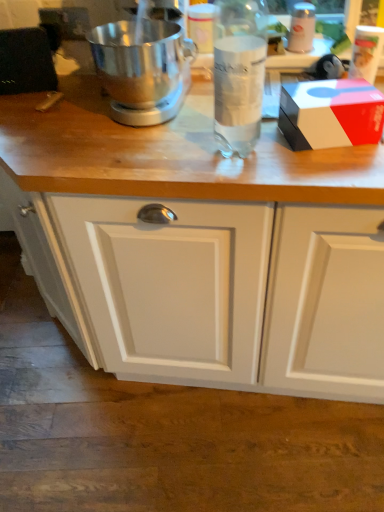
In order to face clear glass bottle at center, the second bottle in the right-to-left sequence, should I rotate leftwards or rightwards?

Turn right approximately 6.570 degrees to face it.

What do you see at coordinates (213, 289) in the screenshot? This screenshot has width=384, height=512. I see `white matte cabinet at lower center` at bounding box center [213, 289].

Find the location of `white glossy bottle at upper right, which is counted as the 1th bottle, starting from the back`. white glossy bottle at upper right, which is counted as the 1th bottle, starting from the back is located at coordinates (302, 28).

Locate an element on the screen. The image size is (384, 512). polished silver mixer at center is located at coordinates (143, 69).

Identify the location of clear glass bottle at center, which appears as the 1th bottle when viewed from the front. (239, 73).

Is white matte cabinet at lower center facing towards polished silver mixer at center?

No, white matte cabinet at lower center is not facing towards polished silver mixer at center.

From the image's perspective, between white matte cabinet at lower center and polished silver mixer at center, who is located below?

white matte cabinet at lower center.

Based on the photo, which object is wider, white matte cabinet at lower center or polished silver mixer at center?

white matte cabinet at lower center is wider.

The image size is (384, 512). Identify the location of cabinetry below the polished silver mixer at center (from the image's perspective). (213, 289).

Which object is wider, clear glass bottle at center, which is the 1th bottle in bottom-to-top order, or polished silver mixer at center?

Wider between the two is polished silver mixer at center.

Visually, is clear glass bottle at center, positioned as the second bottle in back-to-front order, positioned to the left or to the right of polished silver mixer at center?

From the image, it's evident that clear glass bottle at center, positioned as the second bottle in back-to-front order, is to the right of polished silver mixer at center.

From a real-world perspective, who is located lower, clear glass bottle at center, the second bottle positioned from the top, or polished silver mixer at center?

polished silver mixer at center.

How much distance is there between clear glass bottle at center, which appears as the 1th bottle when viewed from the front, and polished silver mixer at center?

The distance of clear glass bottle at center, which appears as the 1th bottle when viewed from the front, from polished silver mixer at center is 10.22 inches.

From the image's perspective, is white matte cabinet at lower center over clear glass bottle at center, which appears as the 1th bottle when viewed from the front?

No, from the image's perspective, white matte cabinet at lower center is not over clear glass bottle at center, which appears as the 1th bottle when viewed from the front.

Which point is more forward, (170,203) or (248,48)?

Point (248,48)

Is clear glass bottle at center, positioned as the second bottle in back-to-front order, a part of white matte cabinet at lower center?

Definitely not — clear glass bottle at center, positioned as the second bottle in back-to-front order, is not inside white matte cabinet at lower center.

From the image's perspective, between polished silver mixer at center and white glossy bottle at upper right, which ranks as the second bottle in left-to-right order, which one is located above?

white glossy bottle at upper right, which ranks as the second bottle in left-to-right order.

Who is taller, polished silver mixer at center or white glossy bottle at upper right, which is counted as the 1th bottle, starting from the back?

With more height is polished silver mixer at center.

Based on their positions, is polished silver mixer at center located to the left or right of white glossy bottle at upper right, the 1th bottle in the top-to-bottom sequence?

polished silver mixer at center is positioned on white glossy bottle at upper right, the 1th bottle in the top-to-bottom sequence,'s left side.

Can you tell me how much polished silver mixer at center and white glossy bottle at upper right, marked as the first bottle in a right-to-left arrangement, differ in facing direction?

There is a 1.33-degree angle between the facing directions of polished silver mixer at center and white glossy bottle at upper right, marked as the first bottle in a right-to-left arrangement.

Considering the sizes of objects polished silver mixer at center and clear glass bottle at center, which is the 1th bottle in bottom-to-top order, in the image provided, who is bigger, polished silver mixer at center or clear glass bottle at center, which is the 1th bottle in bottom-to-top order,?

polished silver mixer at center.

Is clear glass bottle at center, the second bottle positioned from the top, completely or partially inside polished silver mixer at center?

Actually, clear glass bottle at center, the second bottle positioned from the top, is outside polished silver mixer at center.

Is polished silver mixer at center further to camera compared to clear glass bottle at center, positioned as the second bottle in back-to-front order?

Yes, polished silver mixer at center is further from the viewer.

From the image's perspective, between white matte cabinet at lower center and white glossy bottle at upper right, marked as the 2th bottle in a bottom-to-top arrangement, which one is located above?

white glossy bottle at upper right, marked as the 2th bottle in a bottom-to-top arrangement.

Is white matte cabinet at lower center oriented away from white glossy bottle at upper right, the 1th bottle in the top-to-bottom sequence?

No, white glossy bottle at upper right, the 1th bottle in the top-to-bottom sequence, is not at the back of white matte cabinet at lower center.

Who is shorter, white matte cabinet at lower center or white glossy bottle at upper right, which ranks as the second bottle in left-to-right order?

Standing shorter between the two is white matte cabinet at lower center.

Can you confirm if white glossy bottle at upper right, which ranks as the second bottle in left-to-right order, is positioned to the left of polished silver mixer at center?

No, white glossy bottle at upper right, which ranks as the second bottle in left-to-right order, is not to the left of polished silver mixer at center.

Is white glossy bottle at upper right, the 1th bottle in the top-to-bottom sequence, in contact with polished silver mixer at center?

No.

Locate an element on the screen. cabinetry below the polished silver mixer at center (from a real-world perspective) is located at coordinates (213, 289).

Find the location of `bottle that appears above the polished silver mixer at center (from a real-world perspective)`. bottle that appears above the polished silver mixer at center (from a real-world perspective) is located at coordinates (239, 73).

When comparing their distances from clear glass bottle at center, which appears as the 1th bottle when viewed from the front, does white glossy bottle at upper right, which ranks as the second bottle in left-to-right order, or white matte cabinet at lower center seem closer?

Based on the image, white matte cabinet at lower center appears to be nearer to clear glass bottle at center, which appears as the 1th bottle when viewed from the front.

Consider the image. From the image, which object appears to be farther from white matte cabinet at lower center, white glossy bottle at upper right, which ranks as the second bottle in left-to-right order, or polished silver mixer at center?

Based on the image, white glossy bottle at upper right, which ranks as the second bottle in left-to-right order, appears to be further to white matte cabinet at lower center.

When comparing their distances from clear glass bottle at center, which appears as the 1th bottle when viewed from the front, does white glossy bottle at upper right, which is counted as the 1th bottle, starting from the back, or polished silver mixer at center seem further?

Among the two, white glossy bottle at upper right, which is counted as the 1th bottle, starting from the back, is located further to clear glass bottle at center, which appears as the 1th bottle when viewed from the front.

When comparing their distances from polished silver mixer at center, does white glossy bottle at upper right, acting as the 2th bottle starting from the front, or clear glass bottle at center, positioned as the second bottle in back-to-front order, seem closer?

clear glass bottle at center, positioned as the second bottle in back-to-front order, is closer to polished silver mixer at center.

Estimate the real-world distances between objects in this image. Which object is closer to white matte cabinet at lower center, clear glass bottle at center, placed as the first bottle when sorted from left to right, or polished silver mixer at center?

The object closer to white matte cabinet at lower center is clear glass bottle at center, placed as the first bottle when sorted from left to right.

Looking at the image, which one is located further to white glossy bottle at upper right, marked as the 2th bottle in a bottom-to-top arrangement, polished silver mixer at center or white matte cabinet at lower center?

The object further to white glossy bottle at upper right, marked as the 2th bottle in a bottom-to-top arrangement, is white matte cabinet at lower center.

Which object lies nearer to the anchor point clear glass bottle at center, positioned as the second bottle in back-to-front order, polished silver mixer at center or white glossy bottle at upper right, which is counted as the 1th bottle, starting from the back?

polished silver mixer at center lies closer to clear glass bottle at center, positioned as the second bottle in back-to-front order, than the other object.

Considering their positions, is white matte cabinet at lower center positioned closer to clear glass bottle at center, the second bottle in the right-to-left sequence, than polished silver mixer at center?

Among the two, polished silver mixer at center is located nearer to clear glass bottle at center, the second bottle in the right-to-left sequence.

The image size is (384, 512). I want to click on bottle between polished silver mixer at center and white matte cabinet at lower center in the vertical direction, so click(239, 73).

Find the location of a particular element. The width and height of the screenshot is (384, 512). bottle between white glossy bottle at upper right, which is counted as the 1th bottle, starting from the back, and white matte cabinet at lower center in the up-down direction is located at coordinates (239, 73).

At what (x,y) coordinates should I click in order to perform the action: click on mixer between white glossy bottle at upper right, marked as the 2th bottle in a bottom-to-top arrangement, and white matte cabinet at lower center in the up-down direction. Please return your answer as a coordinate pair (x, y). The image size is (384, 512). Looking at the image, I should click on (143, 69).

The image size is (384, 512). I want to click on mixer between clear glass bottle at center, which appears as the 1th bottle when viewed from the front, and white glossy bottle at upper right, marked as the 2th bottle in a bottom-to-top arrangement, from front to back, so click(143, 69).